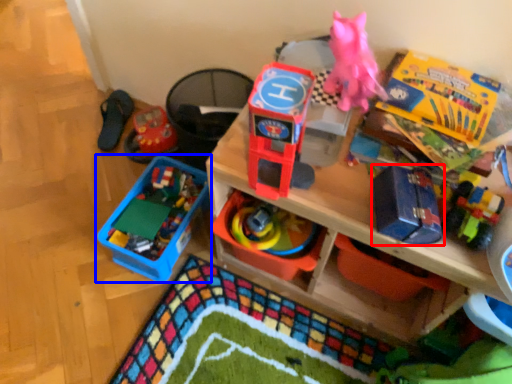
Question: Which object is closer to the camera taking this photo, toy (highlighted by a red box) or toy (highlighted by a blue box)?

Choices:
 (A) toy
 (B) toy

Answer: (A)